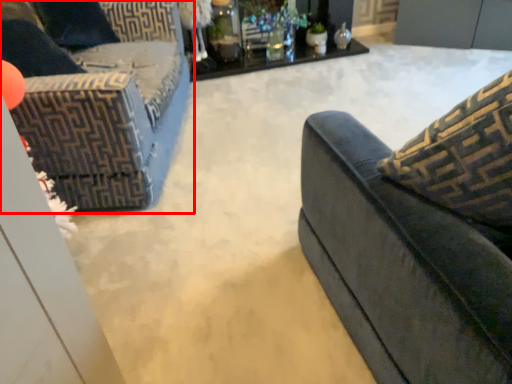
Question: From the image's perspective, what is the correct spatial relationship of studio couch (annotated by the red box) in relation to table?

Choices:
 (A) above
 (B) below

Answer: (B)